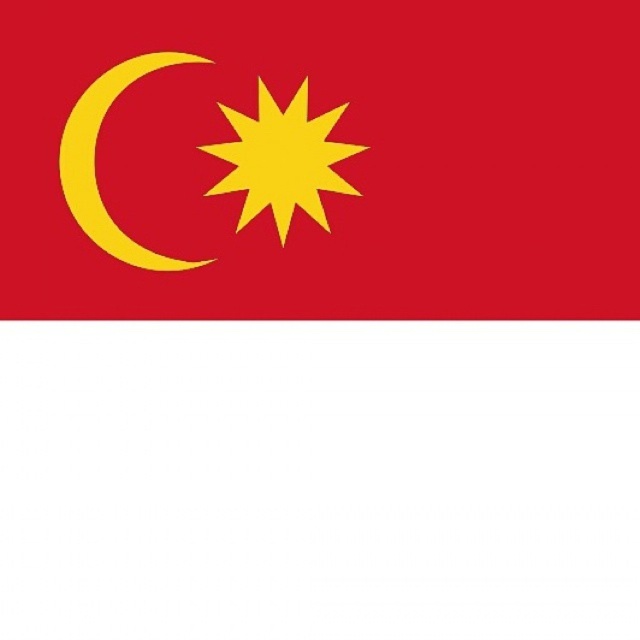
You are an astronaut floating in space and see the flag of Malaysia. You need to report the exact position of the matte red flag at upper left in the image. What are its coordinates?

The matte red flag at upper left is located at coordinates point (317, 157).

You are holding a ruler and want to measure the distance from your eyes to the matte red flag at upper left in the image. What would the ruler show?

The ruler would show that the matte red flag at upper left is 35.47 inches away from the viewer.

Looking at this image, you are standing in front of the Malaysian flag. There is a point marked at coordinates point (317, 157). Based on the flag description, what color is the area around this point?

The point (317, 157) is on the matte red flag at upper left, so the area around this point is red.